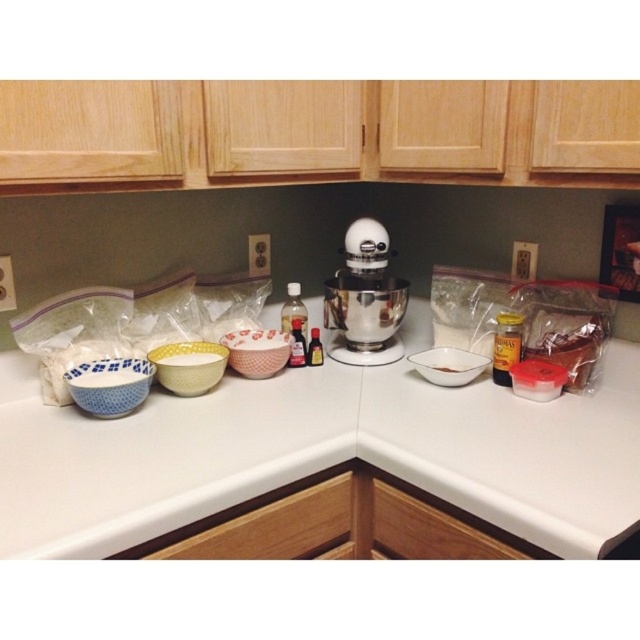
Question: Can you confirm if white glossy square bowl at center is positioned below white matte bowl at center?

Choices:
 (A) no
 (B) yes

Answer: (A)

Question: Estimate the real-world distances between objects in this image. Which object is farther from the white glossy square bowl at center?

Choices:
 (A) white metallic stand mixer at center
 (B) white matte bowl at center

Answer: (A)

Question: Considering the relative positions of white glossy countertop at center and white polka dot bowl at center in the image provided, where is white glossy countertop at center located with respect to white polka dot bowl at center?

Choices:
 (A) above
 (B) below

Answer: (B)

Question: Where is white metallic stand mixer at center located in relation to white matte bowl at center in the image?

Choices:
 (A) below
 (B) above

Answer: (B)

Question: Among these objects, which one is nearest to the camera?

Choices:
 (A) blue and white ceramic bowl at left
 (B) white glossy square bowl at center
 (C) pink floral ceramic mixing bowl at center

Answer: (A)

Question: Which is nearer to the yellow polka dot bowl at center?

Choices:
 (A) white glossy square bowl at center
 (B) blue and white ceramic bowl at left
 (C) white glossy countertop at center
 (D) white polka dot bowl at center

Answer: (B)